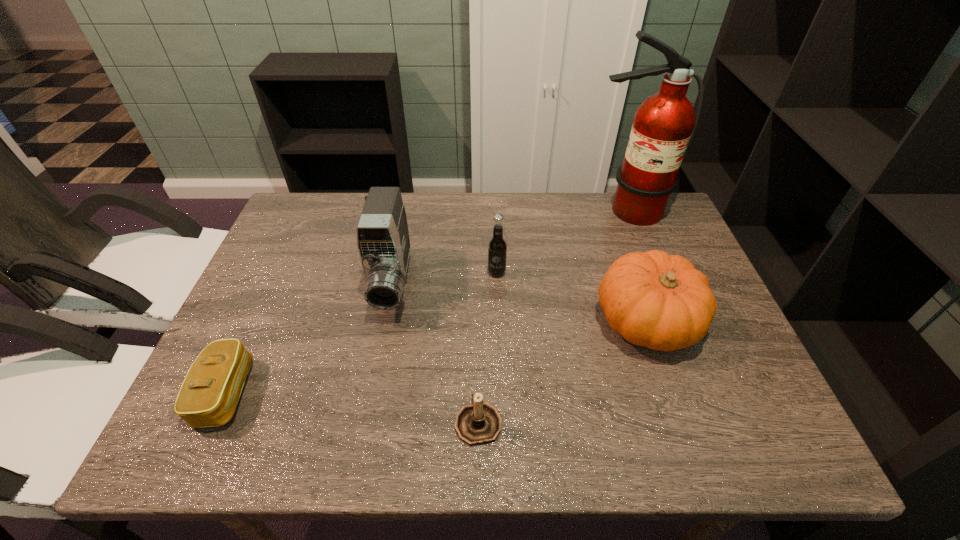
Where is `pumpkin positioned at the right edge`? The width and height of the screenshot is (960, 540). pumpkin positioned at the right edge is located at coordinates (660, 301).

At what (x,y) coordinates should I click in order to perform the action: click on object that is at the near left corner. Please return your answer as a coordinate pair (x, y). Looking at the image, I should click on (208, 397).

Locate an element on the screen. object that is at the far right corner is located at coordinates (664, 124).

In order to click on vacant space at the far edge of the desktop in this screenshot , I will do `click(569, 194)`.

In the image, there is a desktop. Where is `vacant space at the near edge`? vacant space at the near edge is located at coordinates (557, 449).

This screenshot has height=540, width=960. In the image, there is a desktop. Identify the location of free space at the left edge. (301, 282).

The width and height of the screenshot is (960, 540). What are the coordinates of `vacant space at the far left corner of the desktop` in the screenshot? It's located at (313, 230).

Where is `free location at the near right corner`? This screenshot has width=960, height=540. free location at the near right corner is located at coordinates (753, 425).

Image resolution: width=960 pixels, height=540 pixels. In order to click on free space between the clutch bag and the root beer in this screenshot , I will do `click(361, 333)`.

At what (x,y) coordinates should I click in order to perform the action: click on free spot between the root beer and the second shortest object. Please return your answer as a coordinate pair (x, y). The height and width of the screenshot is (540, 960). Looking at the image, I should click on 488,347.